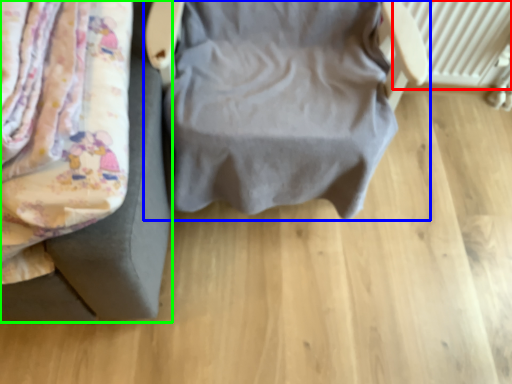
Question: Considering the real-world distances, which object is closest to radiator (highlighted by a red box)? furniture (highlighted by a blue box) or furniture (highlighted by a green box).

Choices:
 (A) furniture
 (B) furniture

Answer: (A)